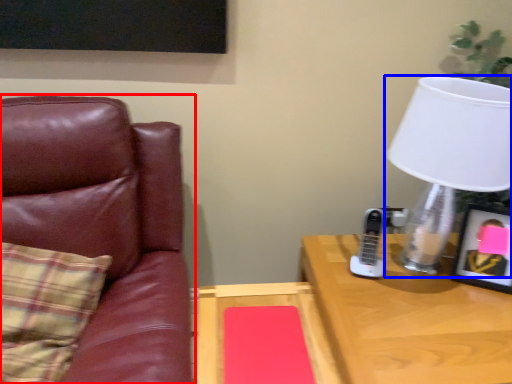
Question: Which object appears farthest to the camera in this image, chair (highlighted by a red box) or lamp (highlighted by a blue box)?

Choices:
 (A) chair
 (B) lamp

Answer: (B)